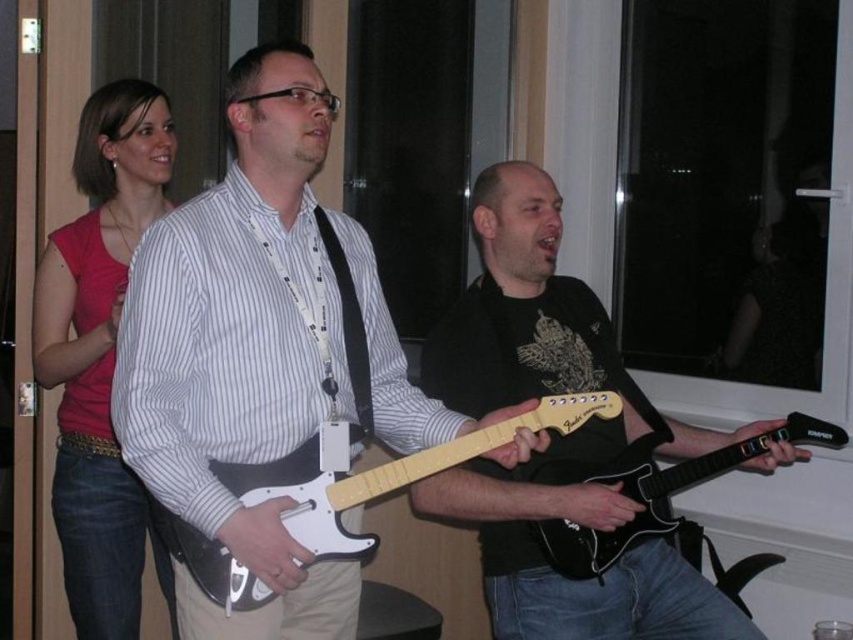
What is the location of the point with coordinates (556, 436) in relation to the black matte guitar at center?

The point with coordinates (556, 436) is located on the black matte guitar at center.

You are a music instructor who wants to place a 18 inch long amplifier between the white matte electric guitar at center and the black matte electric guitar at center. Is there enough space between them to fit the amplifier?

The white matte electric guitar at center and black matte electric guitar at center are 20.25 inches apart from each other. Since the amplifier is 18 inches long, there is enough space between them to fit the amplifier.

You are a photographer standing in front of the scene. You want to take a photo of both the white matte electric guitar at center and the black matte electric guitar at center. Which guitar should you focus on first to ensure both are in focus?

The white matte electric guitar at center is closer to the viewer than the black matte electric guitar at center. To ensure both are in focus, focus on the white matte electric guitar at center first since it is closer, and the black one will fall into the depth of field range.